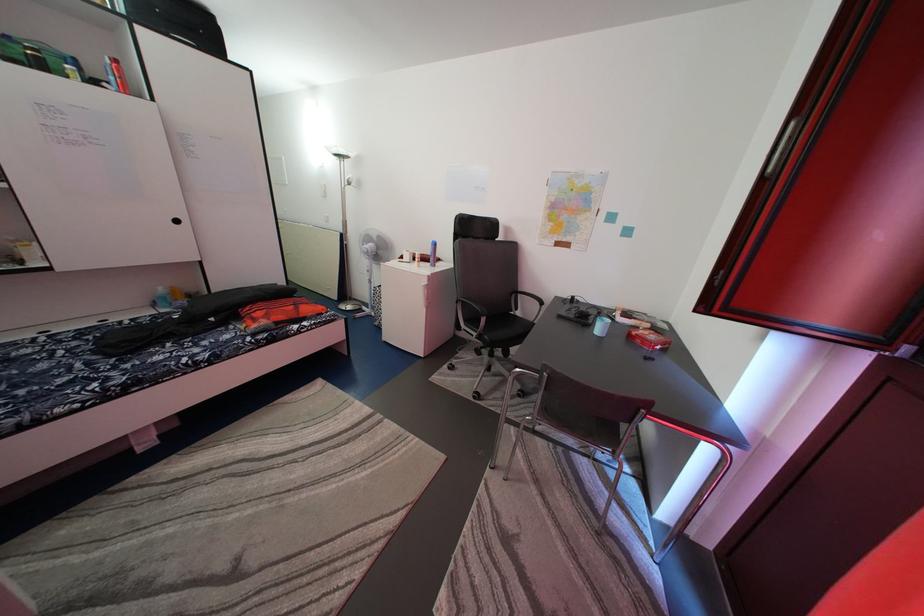
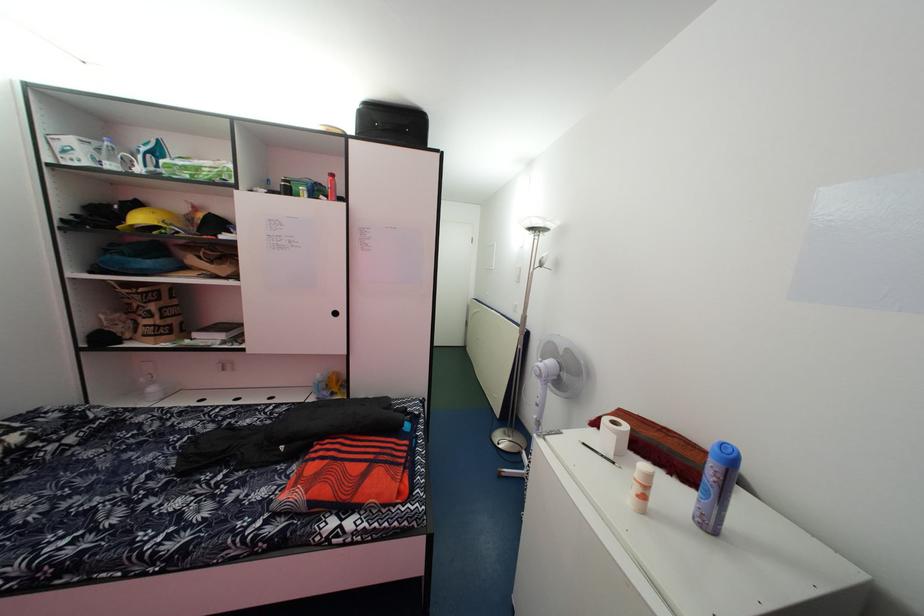
Where in the second image is the point corresponding to pixel 408 267 from the first image?

(600, 442)